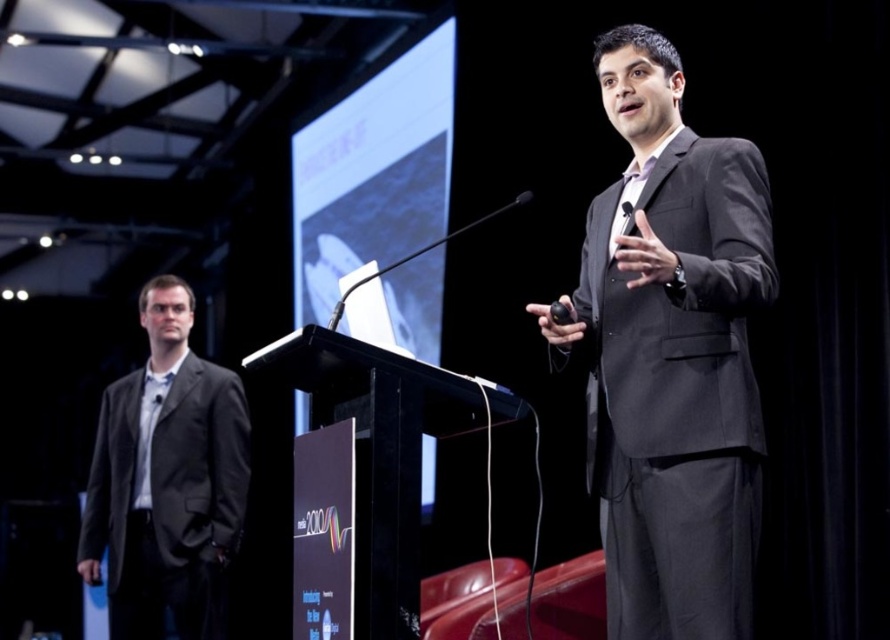
Question: Which point is farther to the camera?

Choices:
 (A) (630, 208)
 (B) (373, 586)
 (C) (759, 205)
 (D) (158, 513)

Answer: (D)

Question: Considering the relative positions of dark gray corduroy suit at left and black matte podium at center in the image provided, where is dark gray corduroy suit at left located with respect to black matte podium at center?

Choices:
 (A) left
 (B) right

Answer: (A)

Question: Which point is farther to the camera?

Choices:
 (A) (623, 204)
 (B) (620, 538)

Answer: (A)

Question: Observing the image, what is the correct spatial positioning of matte black suit at center in reference to dark gray corduroy suit at left?

Choices:
 (A) left
 (B) right

Answer: (B)

Question: Is dark gray corduroy suit at left closer to camera compared to black plastic microphone at center?

Choices:
 (A) yes
 (B) no

Answer: (B)

Question: Among these objects, which one is farthest from the camera?

Choices:
 (A) matte black suit at center
 (B) dark gray corduroy suit at left
 (C) black matte podium at center

Answer: (B)